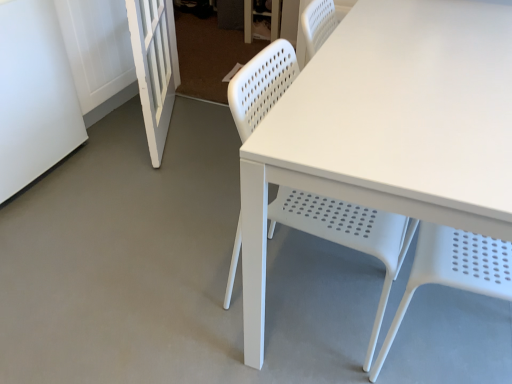
Find the location of a particular element. This screenshot has width=512, height=384. blank area beneath white matte screen door at left, positioned as the second screen door in left-to-right order (from a real-world perspective) is located at coordinates (173, 122).